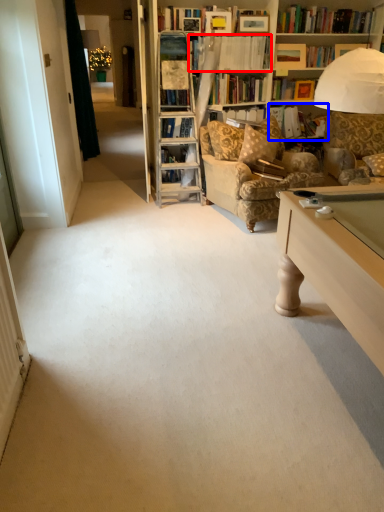
Question: Which point is further to the camera, book (highlighted by a red box) or book (highlighted by a blue box)?

Choices:
 (A) book
 (B) book

Answer: (B)